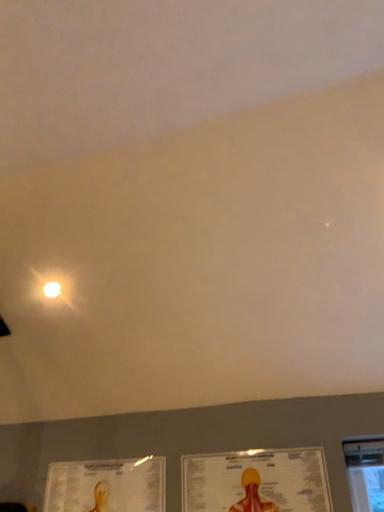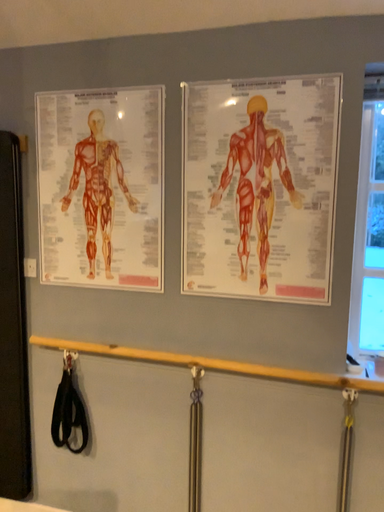
Question: How did the camera likely rotate when shooting the video?

Choices:
 (A) rotated downward
 (B) rotated upward

Answer: (A)